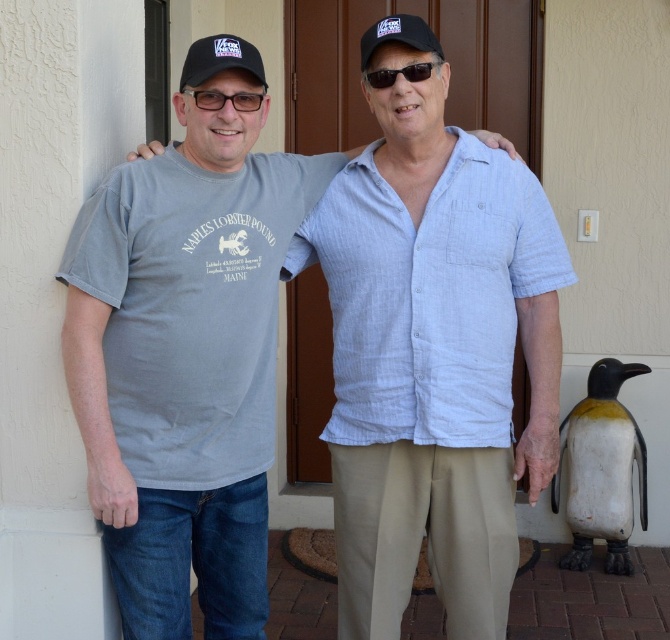
You are standing in front of the beige wall with a brown door and want to place a small plant between the two points marked as point (302, 198) and point (243, 106). Which point should the plant be closer to in order to be nearer to the viewer?

The plant should be closer to point (302, 198) because it is further to the viewer than point (243, 106).